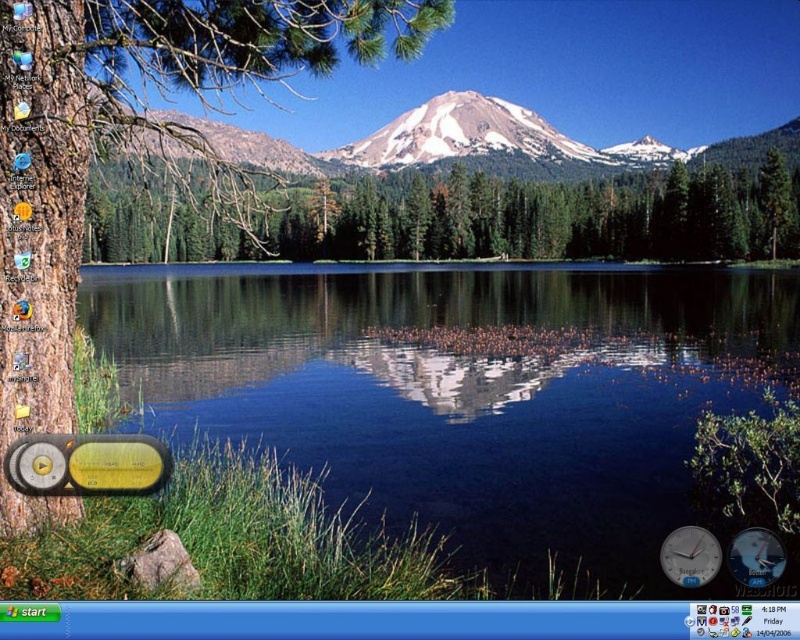
Question: Can you confirm if clear water at center is positioned to the left of snowy granite mountain at center?

Choices:
 (A) yes
 (B) no

Answer: (A)

Question: Which point is closer to the camera?

Choices:
 (A) (450, 100)
 (B) (38, 509)
 (C) (176, 225)
 (D) (432, 316)

Answer: (B)

Question: Which of the following is the farthest from the observer?

Choices:
 (A) (406, 29)
 (B) (428, 160)

Answer: (B)

Question: Is clear water at center bigger than green matte tree at center?

Choices:
 (A) yes
 (B) no

Answer: (B)

Question: Which point appears closest to the camera in this image?

Choices:
 (A) (46, 168)
 (B) (392, 120)

Answer: (A)

Question: Is brown rough bark tree at left above snowy granite mountain at center?

Choices:
 (A) yes
 (B) no

Answer: (B)